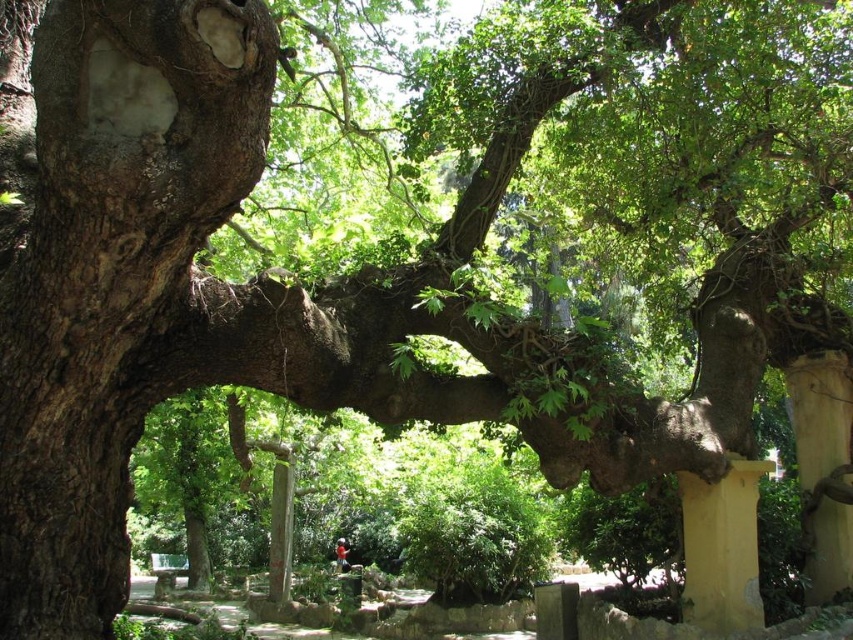
You are standing in the garden and see the two yellow painted stone pillars. Which one is closer to you, the yellow painted stone pillar at lower right or the yellow painted stone pillar at right?

The yellow painted stone pillar at lower right is closer to you because it is in front of the yellow painted stone pillar at right.